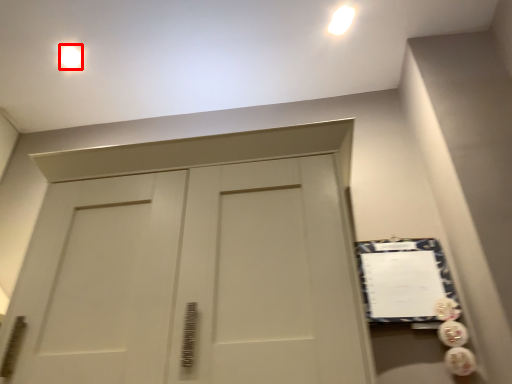
Question: Considering the relative positions of lighting (annotated by the red box) and bulletin board in the image provided, where is lighting (annotated by the red box) located with respect to the staircase?

Choices:
 (A) left
 (B) right

Answer: (A)